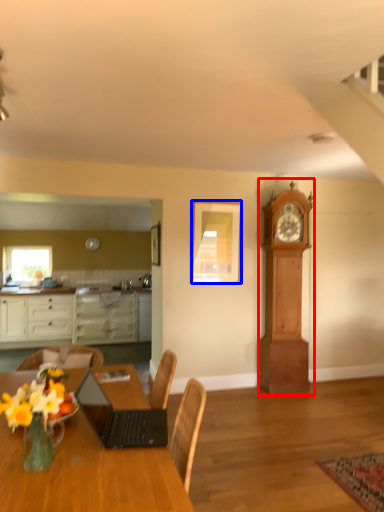
Question: Which object appears farthest to the camera in this image, clock (highlighted by a red box) or picture frame (highlighted by a blue box)?

Choices:
 (A) clock
 (B) picture frame

Answer: (B)